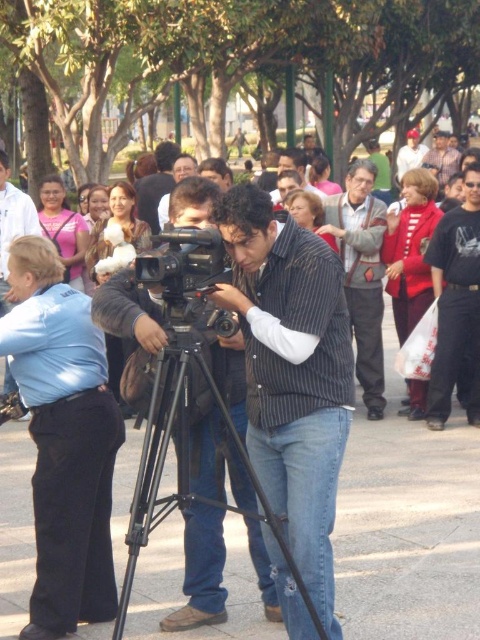
Does dark blue jeans at center have a greater width compared to black plastic video camera at center?

Yes.

Which is behind, point (464, 301) or point (217, 321)?

The point (464, 301) is behind.

Which is behind, point (462, 358) or point (159, 266)?

Point (462, 358)

Where is `dark blue jeans at center`? This screenshot has height=640, width=480. dark blue jeans at center is located at coordinates (456, 305).

Between black plastic video camera at center and striped shirt at center, which one has more height?

striped shirt at center

Does black plastic video camera at center come in front of striped shirt at center?

Yes, black plastic video camera at center is in front of striped shirt at center.

Describe the element at coordinates (183, 275) in the screenshot. I see `black plastic video camera at center` at that location.

Identify the location of black plastic video camera at center. This screenshot has height=640, width=480. (183, 275).

Is striped sweater at center taller than matte black vest at center?

Indeed, striped sweater at center has a greater height compared to matte black vest at center.

Identify the location of striped sweater at center. (361, 273).